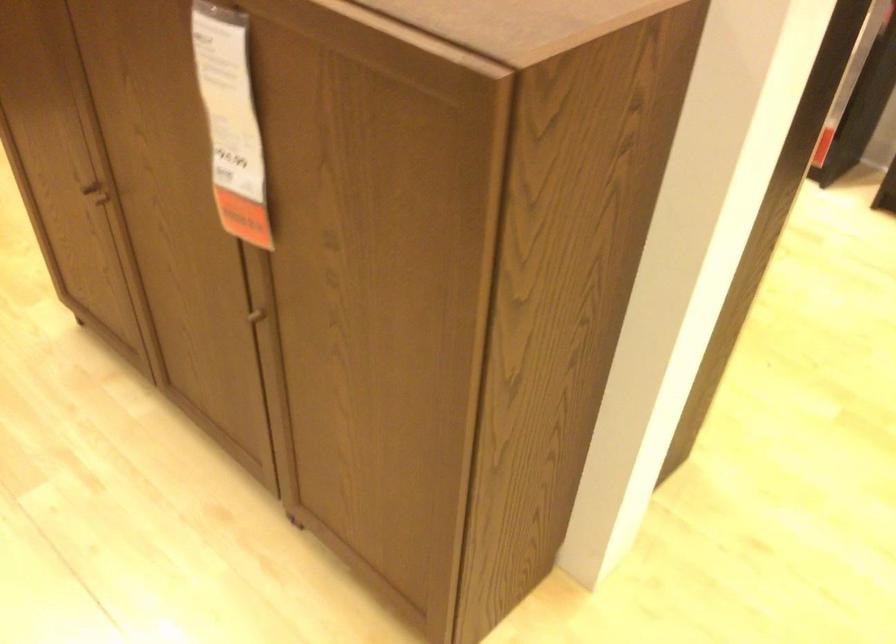
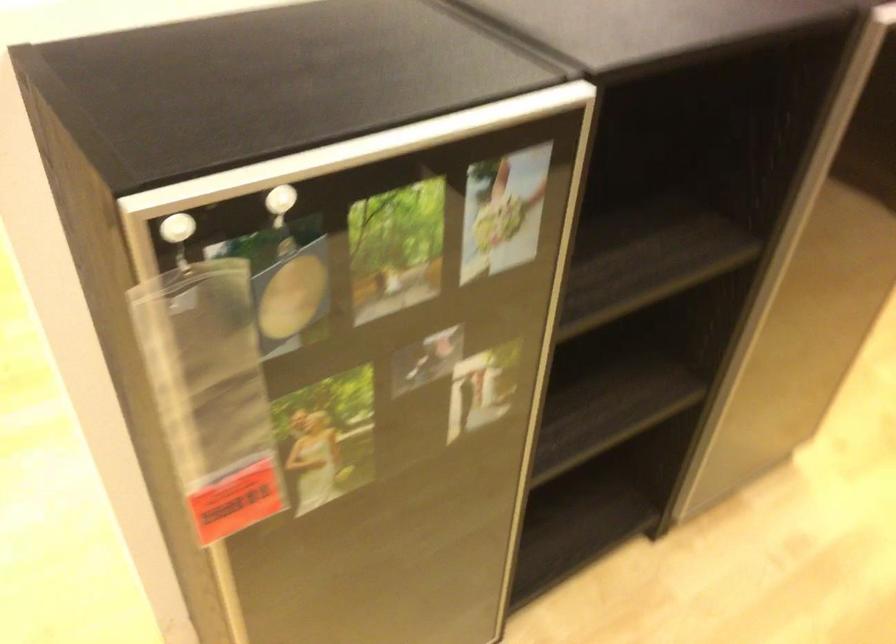
Question: I am providing you with two images of the same scene from different viewpoints. After the viewpoint changes to image2, which objects are now occluded?

Choices:
 (A) clear plastic pouch
 (B) white circular magnet
 (C) purple lotion tube
 (D) brown cabinet handle

Answer: (D)